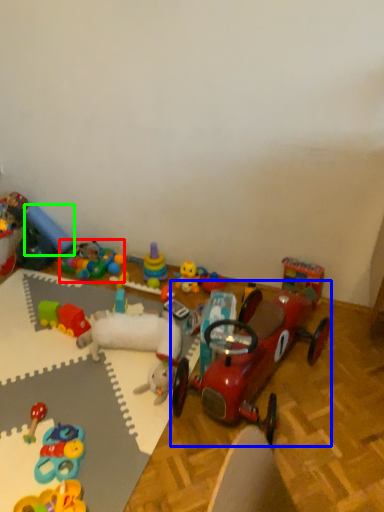
Question: Which object is positioned farthest from toy (highlighted by a red box)? Select from toy (highlighted by a blue box) and toy (highlighted by a green box).

Choices:
 (A) toy
 (B) toy

Answer: (A)